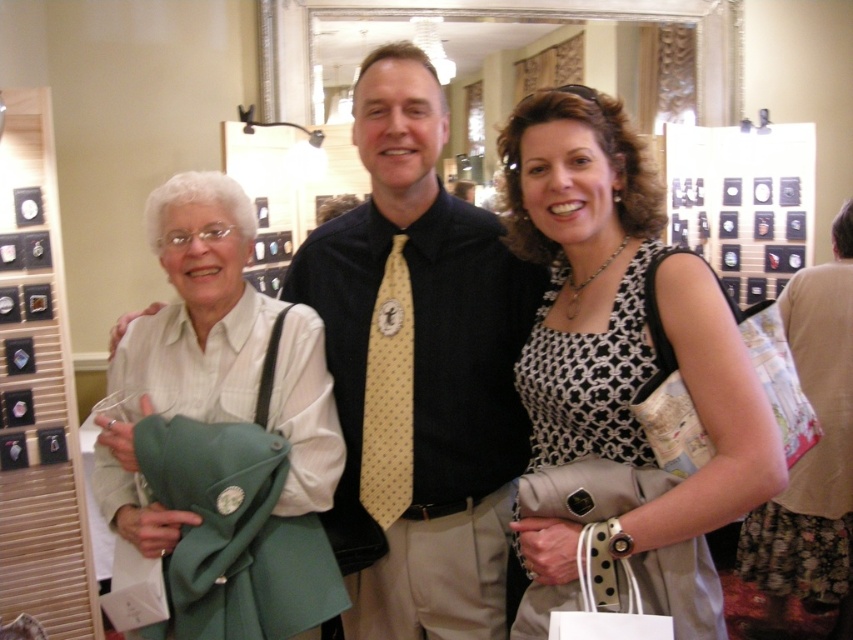
Question: Can you confirm if yellow dotted tie at center is wider than black and white dress at center?

Choices:
 (A) yes
 (B) no

Answer: (A)

Question: Based on their relative distances, which object is farther from the beige dotted tie at center?

Choices:
 (A) white cotton shirt at center
 (B) yellow dotted tie at center

Answer: (A)

Question: Does white cotton shirt at center lie in front of beige dotted tie at center?

Choices:
 (A) yes
 (B) no

Answer: (A)

Question: Does yellow dotted tie at center appear under beige dotted tie at center?

Choices:
 (A) yes
 (B) no

Answer: (B)

Question: Which point is farther to the camera?

Choices:
 (A) (680, 250)
 (B) (393, 250)
 (C) (200, 323)
 (D) (769, 582)

Answer: (D)

Question: Which point is closer to the camera?

Choices:
 (A) beige dotted tie at center
 (B) white cotton shirt at center

Answer: (B)